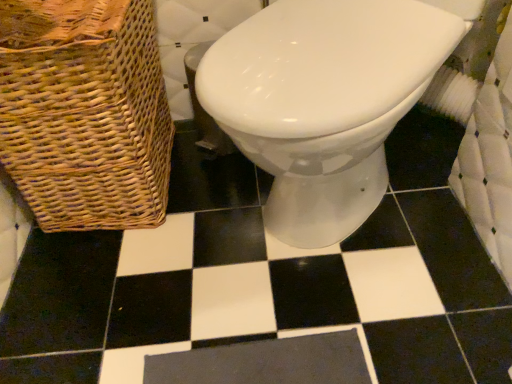
Question: Can you confirm if white glossy toilet at center is positioned to the left of woven brown basket at left?

Choices:
 (A) no
 (B) yes

Answer: (A)

Question: Is white glossy toilet at center bigger than woven brown basket at left?

Choices:
 (A) no
 (B) yes

Answer: (B)

Question: Does white glossy toilet at center have a lesser width compared to woven brown basket at left?

Choices:
 (A) yes
 (B) no

Answer: (B)

Question: Does white glossy toilet at center appear on the right side of woven brown basket at left?

Choices:
 (A) no
 (B) yes

Answer: (B)

Question: From a real-world perspective, is white glossy toilet at center positioned under woven brown basket at left based on gravity?

Choices:
 (A) no
 (B) yes

Answer: (A)

Question: Can you confirm if white glossy toilet at center is shorter than woven brown basket at left?

Choices:
 (A) no
 (B) yes

Answer: (A)

Question: Does woven brown basket at left appear on the right side of white glossy toilet at center?

Choices:
 (A) yes
 (B) no

Answer: (B)

Question: Is woven brown basket at left located outside white glossy toilet at center?

Choices:
 (A) yes
 (B) no

Answer: (A)

Question: Can you confirm if woven brown basket at left is shorter than white glossy toilet at center?

Choices:
 (A) no
 (B) yes

Answer: (B)

Question: From a real-world perspective, is woven brown basket at left positioned under white glossy toilet at center based on gravity?

Choices:
 (A) no
 (B) yes

Answer: (B)

Question: Does woven brown basket at left come behind white glossy toilet at center?

Choices:
 (A) yes
 (B) no

Answer: (A)

Question: From the image's perspective, is woven brown basket at left above white glossy toilet at center?

Choices:
 (A) no
 (B) yes

Answer: (B)

Question: From a real-world perspective, is woven brown basket at left positioned above or below white glossy toilet at center?

Choices:
 (A) below
 (B) above

Answer: (A)